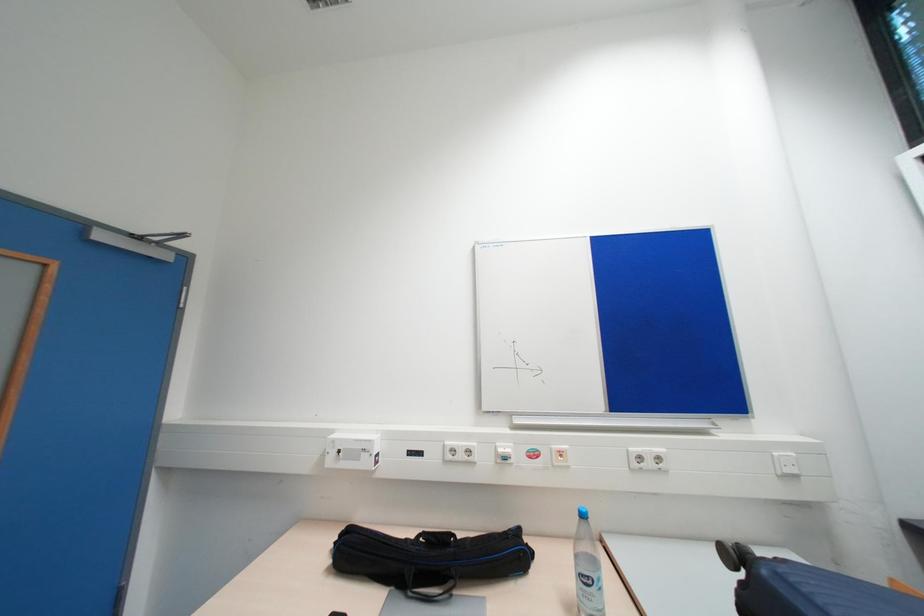
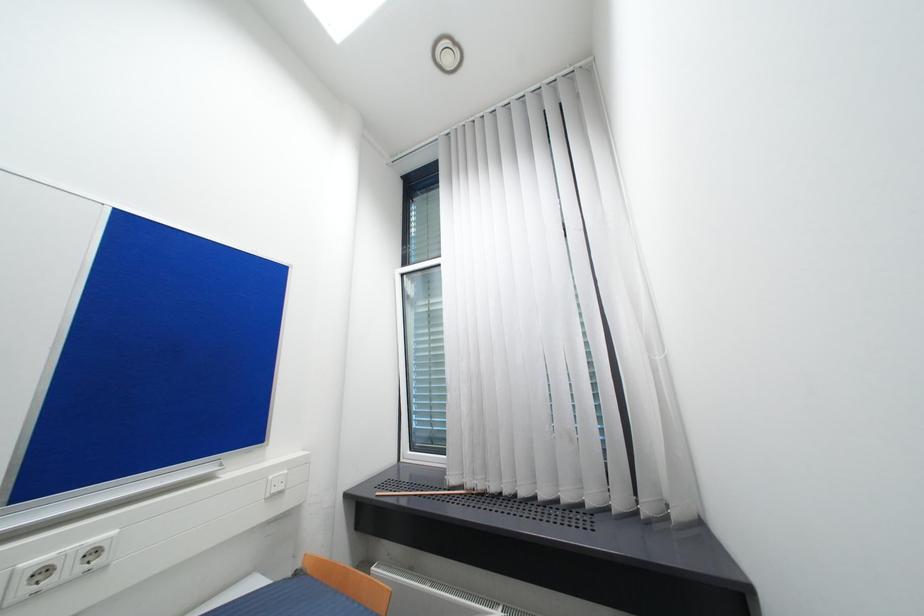
Question: How did the camera likely rotate?

Choices:
 (A) Left
 (B) Right
 (C) Up
 (D) Down

Answer: (B)